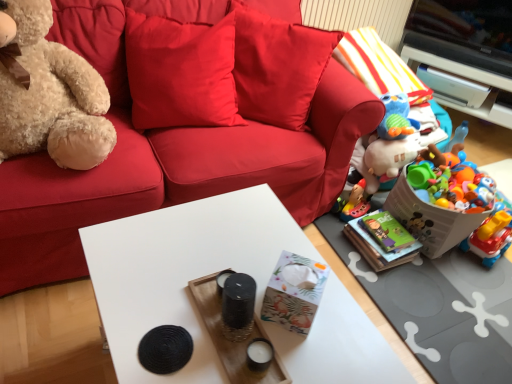
Question: Considering the positions of plastic colorful toys at right, the second toy positioned from the back, and velvet red couch at center in the image, is plastic colorful toys at right, the second toy positioned from the back, wider or thinner than velvet red couch at center?

Choices:
 (A) wide
 (B) thin

Answer: (B)

Question: Would you say plastic colorful toys at right, the 2th toy when ordered from front to back, is to the left or to the right of velvet red couch at center in the picture?

Choices:
 (A) left
 (B) right

Answer: (B)

Question: Which of these objects is positioned closest to the white matte table at center?

Choices:
 (A) white glossy cabinet at upper right
 (B) fuzzy beige teddy bear at left
 (C) plastic colorful toys at right, the second toy positioned from the back
 (D) satin red pillow at upper center
 (E) black woven coaster at lower center, the 3th toy when ordered from right to left

Answer: (E)

Question: Estimate the real-world distances between objects in this image. Which object is closer to the black woven coaster at lower center, positioned as the 3th toy in back-to-front order?

Choices:
 (A) white glossy cabinet at upper right
 (B) satin red pillow at upper center
 (C) plastic colorful toys at right, the 2th toy when ordered from right to left
 (D) plastic toy basket at lower right, which appears as the second box when viewed from the front
 (E) floral paper tissue box at center, the 2th box viewed from the right

Answer: (E)